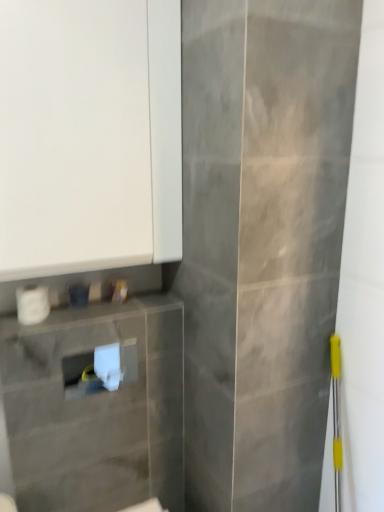
Question: Is white matte toilet paper at lower left inside the boundaries of white matte cabinet at upper left, or outside?

Choices:
 (A) inside
 (B) outside

Answer: (B)

Question: Looking at their shapes, would you say white matte toilet paper at lower left is wider or thinner than white matte cabinet at upper left?

Choices:
 (A) wide
 (B) thin

Answer: (B)

Question: In the image, is white matte toilet paper at lower left on the left side or the right side of white matte cabinet at upper left?

Choices:
 (A) left
 (B) right

Answer: (A)

Question: From the image's perspective, is white matte cabinet at upper left above or below white matte toilet paper at lower left?

Choices:
 (A) below
 (B) above

Answer: (B)

Question: Is white matte cabinet at upper left wider or thinner than white matte toilet paper at lower left?

Choices:
 (A) thin
 (B) wide

Answer: (B)

Question: In terms of height, does white matte cabinet at upper left look taller or shorter compared to white matte toilet paper at lower left?

Choices:
 (A) short
 (B) tall

Answer: (B)

Question: Based on their sizes in the image, would you say white matte cabinet at upper left is bigger or smaller than white matte toilet paper at lower left?

Choices:
 (A) small
 (B) big

Answer: (B)